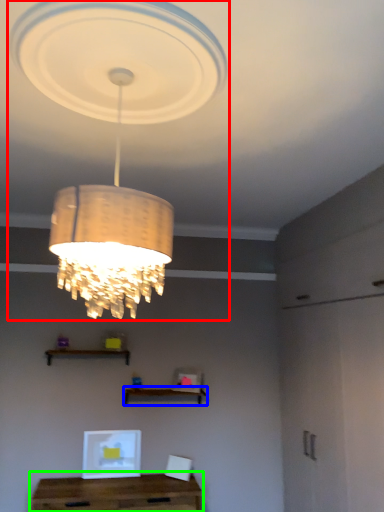
Question: Based on their relative distances, which object is nearer to lamp (highlighted by a red box)? Choose from shelf (highlighted by a blue box) and table (highlighted by a green box).

Choices:
 (A) shelf
 (B) table

Answer: (A)